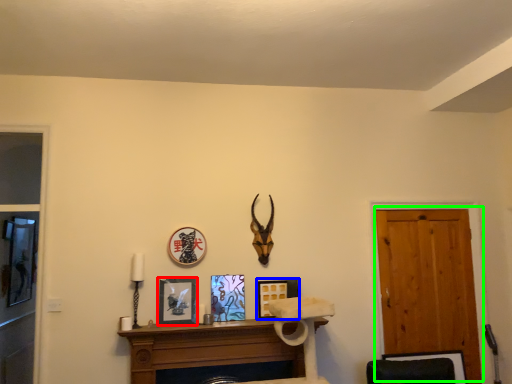
Question: Which is farther away from picture frame (highlighted by a red box)? picture frame (highlighted by a blue box) or door (highlighted by a green box)?

Choices:
 (A) picture frame
 (B) door

Answer: (B)